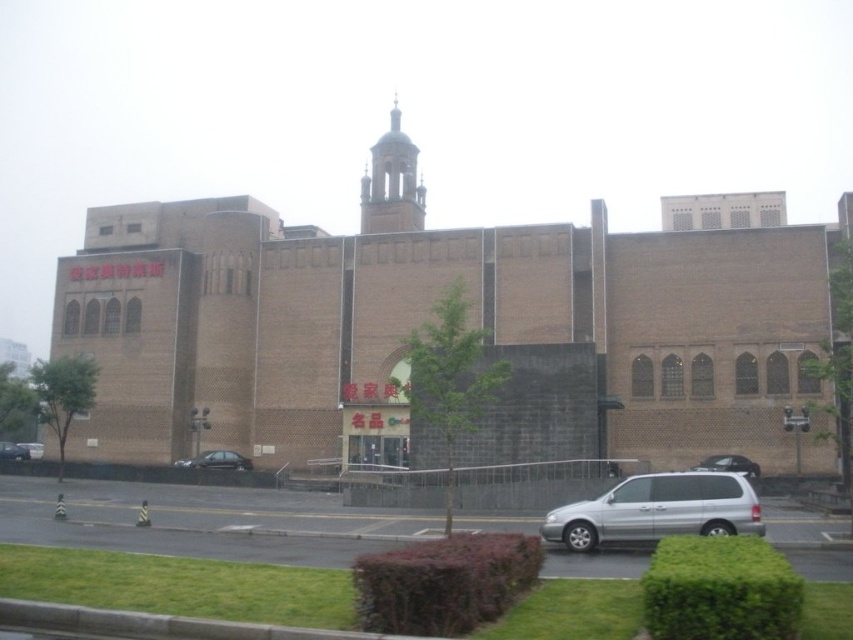
You are a delivery driver who needs to park your vehicle in front of the large multi story building. You see a silver metallic van at center and a black matte car at center. Which vehicle should you move to allow your car to park in the available space?

The silver metallic van at center is in front of the black matte car at center, so you should move the silver metallic van at center to allow space for your car to park.

Looking at this image, you are a visitor arriving at the building and see both the satin black sedan at lower right and the shiny black sedan at lower left parked in the front. Which car is closer to the main entrance of the building?

The shiny black sedan at lower left is closer to the main entrance because it is positioned to the left of the satin black sedan at lower right, and the main entrance is centrally located.

You are a delivery driver who needs to park your vehicle in a tight space near the building. You have two options to choose from. Which vehicle, the silver metallic van at center or the black matte car at center, would require more space to park?

The silver metallic van at center is larger in size than the black matte car at center, so it would require more space to park.